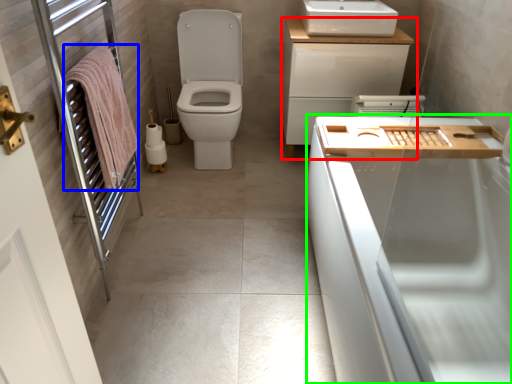
Question: Which is nearer to the bathroom cabinet (highlighted by a red box)? bath towel (highlighted by a blue box) or bath (highlighted by a green box).

Choices:
 (A) bath towel
 (B) bath

Answer: (B)